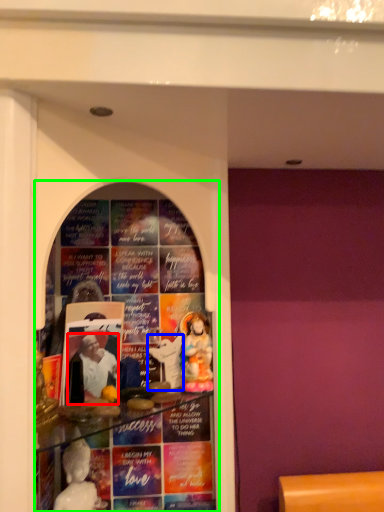
Question: Which object is the farthest from person (highlighted by a red box)? Choose among these: toy (highlighted by a blue box) or shop window (highlighted by a green box).

Choices:
 (A) toy
 (B) shop window

Answer: (B)